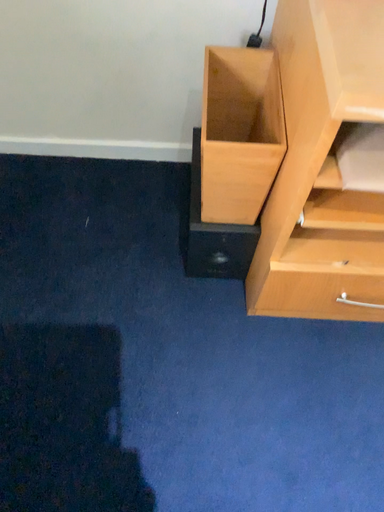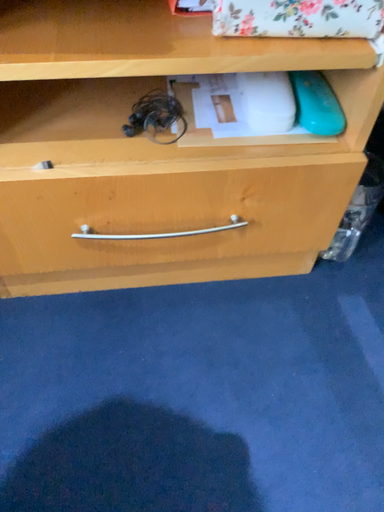
Question: Which way did the camera rotate in the video?

Choices:
 (A) rotated upward
 (B) rotated downward

Answer: (A)